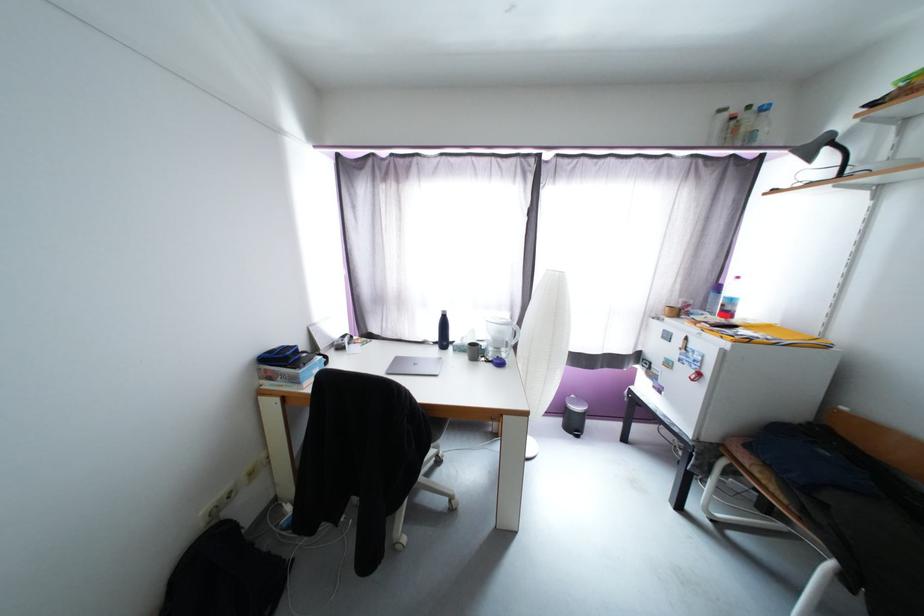
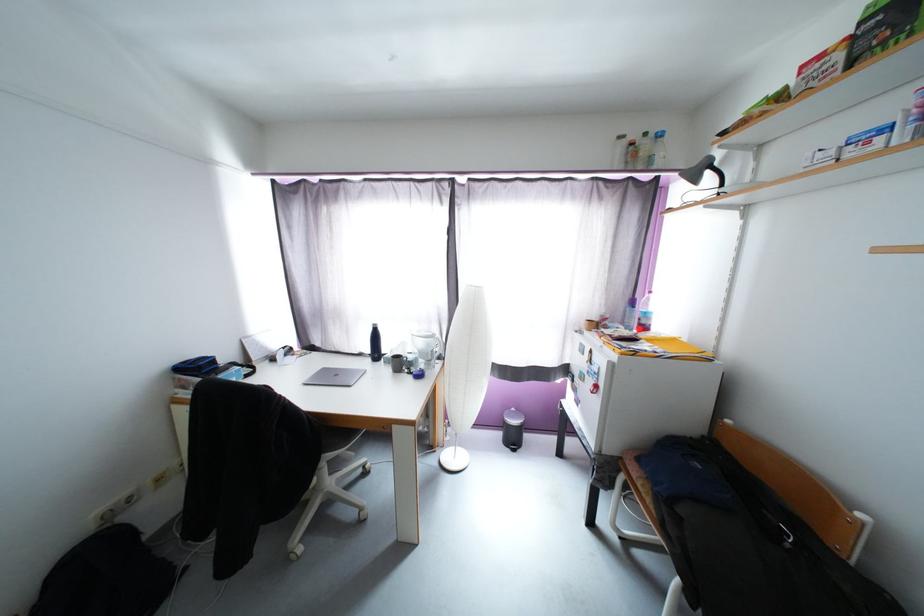
Locate, in the second image, the point that corresponds to the point at 718,296 in the first image.

(634, 310)